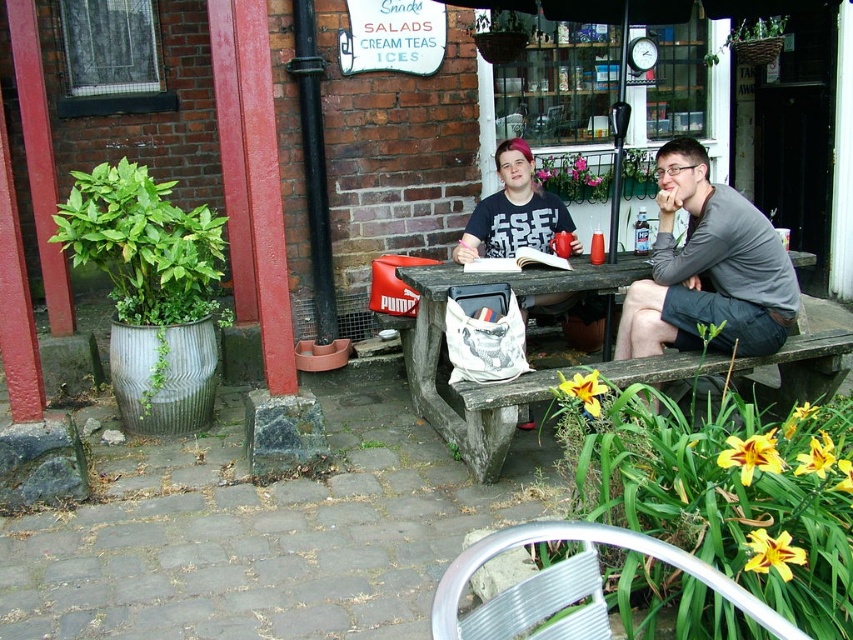
Describe the element at coordinates (708, 269) in the screenshot. I see `gray cotton shirt at center` at that location.

I want to click on gray cotton shirt at center, so click(708, 269).